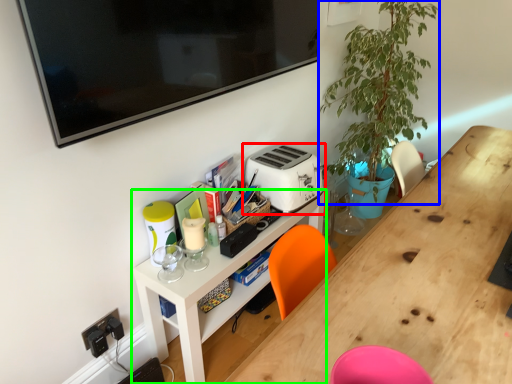
Question: Considering the real-world distances, which object is farthest from toaster (highlighted by a red box)? plant (highlighted by a blue box) or shelf (highlighted by a green box)?

Choices:
 (A) plant
 (B) shelf

Answer: (A)